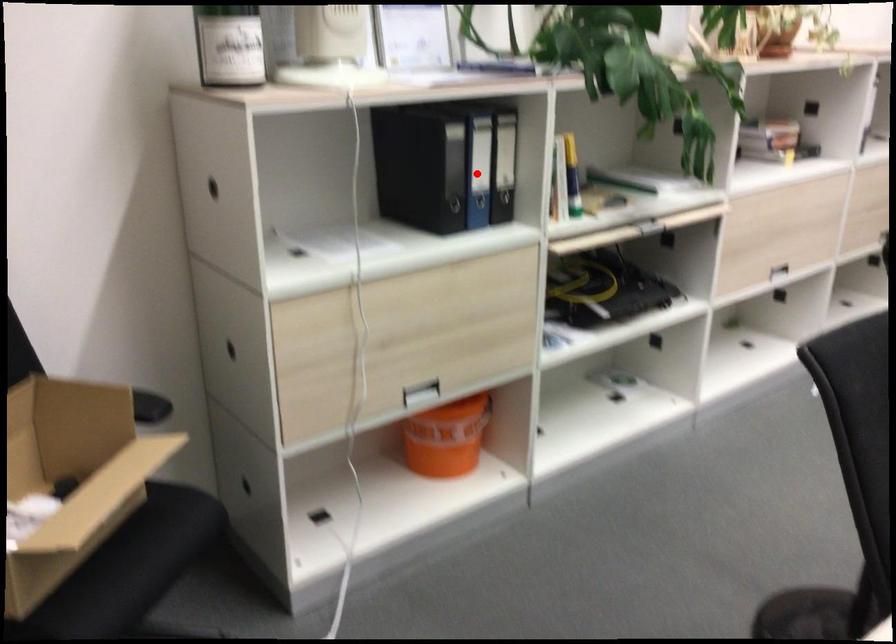
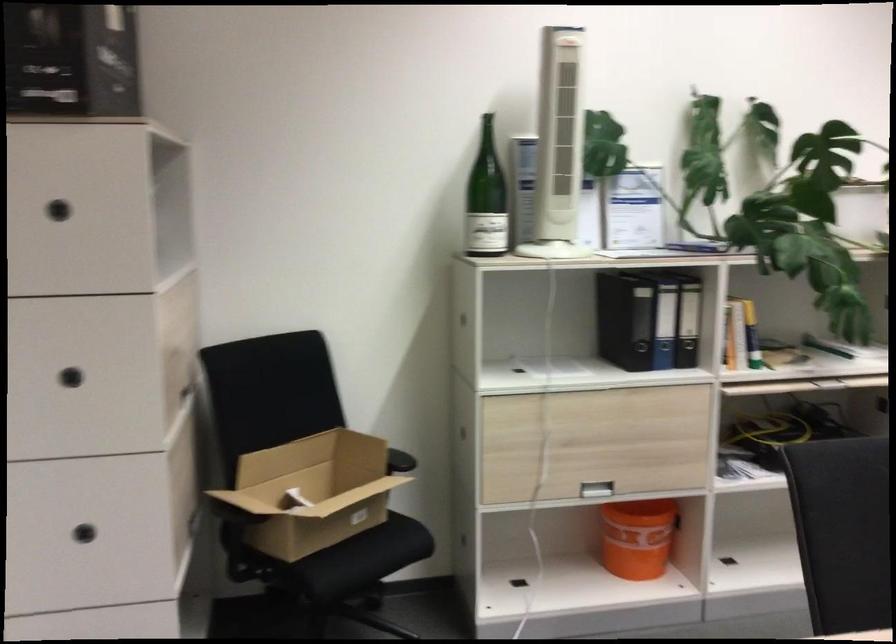
In the second image, find the point that corresponds to the highlighted location in the first image.

(664, 325)